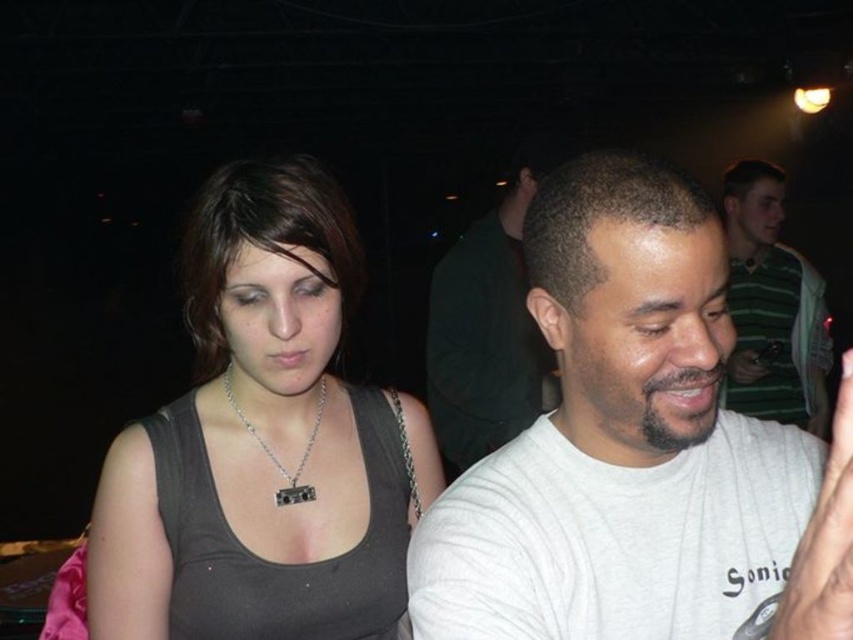
You are at a party and need to find someone wearing a matte black tank top at center. Can you see the green striped shirt at upper right behind them?

Yes, the matte black tank top at center is in front of the green striped shirt at upper right, so the green striped shirt at upper right is visible behind them.

You are at a social gathering and want to locate the green striped shirt at upper right. According to the coordinates provided, where exactly should you look in the image?

The green striped shirt at upper right is located at point (772, 307) in the image.